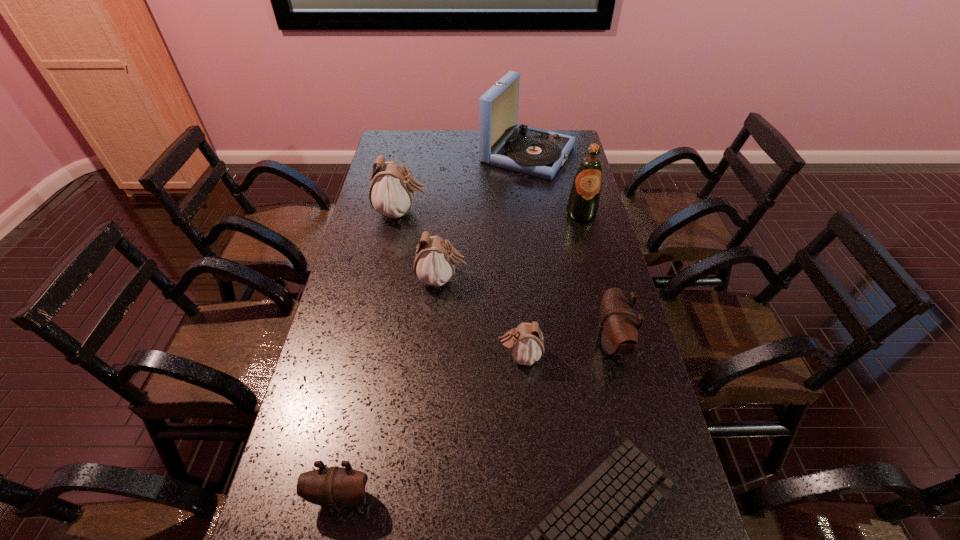
The height and width of the screenshot is (540, 960). Find the location of `the smallest white pouch`. the smallest white pouch is located at coordinates (525, 343).

Where is `the nearest pouch`? The height and width of the screenshot is (540, 960). the nearest pouch is located at coordinates (335, 487).

Where is `the nearer brown pouch`? This screenshot has height=540, width=960. the nearer brown pouch is located at coordinates (335, 487).

At what (x,y) coordinates should I click in order to perform the action: click on vacant point located 0.170m on the front of the farthest object. Please return your answer as a coordinate pair (x, y). The image size is (960, 540). Looking at the image, I should click on (535, 206).

I want to click on free region located 0.130m on the front-facing side of the olive oil, so click(x=590, y=248).

Where is `vacant space located on the front-facing side of the biggest white pouch`? The width and height of the screenshot is (960, 540). vacant space located on the front-facing side of the biggest white pouch is located at coordinates (466, 213).

You are a GUI agent. You are given a task and a screenshot of the screen. Output one action in this format:
    pyautogui.click(x=<x>, y=<y>)
    Task: Click on the blank space located on the front-facing side of the second farthest white pouch
    
    Given the screenshot: What is the action you would take?
    pyautogui.click(x=580, y=280)

The height and width of the screenshot is (540, 960). Identify the location of free space located with the flap open on the rightmost pouch. (480, 342).

In order to click on vacant space positioned with the flap open on the rightmost pouch in this screenshot , I will do `click(498, 342)`.

I want to click on vacant area located with the flap open on the rightmost pouch, so click(x=548, y=342).